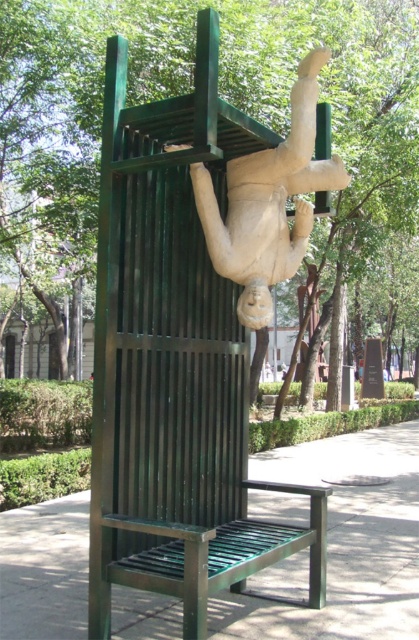
In the scene shown: Can you confirm if green metal bench at center is positioned below white stone figure at upper center?

Yes, green metal bench at center is below white stone figure at upper center.

Who is taller, green metal bench at center or white stone figure at upper center?

Standing taller between the two is white stone figure at upper center.

Consider the image. Measure the distance between point (312, 442) and camera.

41.30 feet

The image size is (419, 640). Find the location of `green metal bench at center`. green metal bench at center is located at coordinates (346, 541).

Is green metallic tree at upper center wider than white stone figure at upper center?

Yes, green metallic tree at upper center is wider than white stone figure at upper center.

Is point (80, 216) positioned before point (325, 161)?

No, (80, 216) is further to viewer.

Between point (20, 93) and point (308, 64), which one is positioned behind?

Point (20, 93)

Where is `green metallic tree at upper center`? green metallic tree at upper center is located at coordinates (178, 92).

Does green metallic tree at upper center appear under green metal bench at center?

Actually, green metallic tree at upper center is above green metal bench at center.

From the picture: Is green metallic tree at upper center positioned in front of green metal bench at center?

No, green metallic tree at upper center is behind green metal bench at center.

Identify the location of green metallic tree at upper center. The width and height of the screenshot is (419, 640). (178, 92).